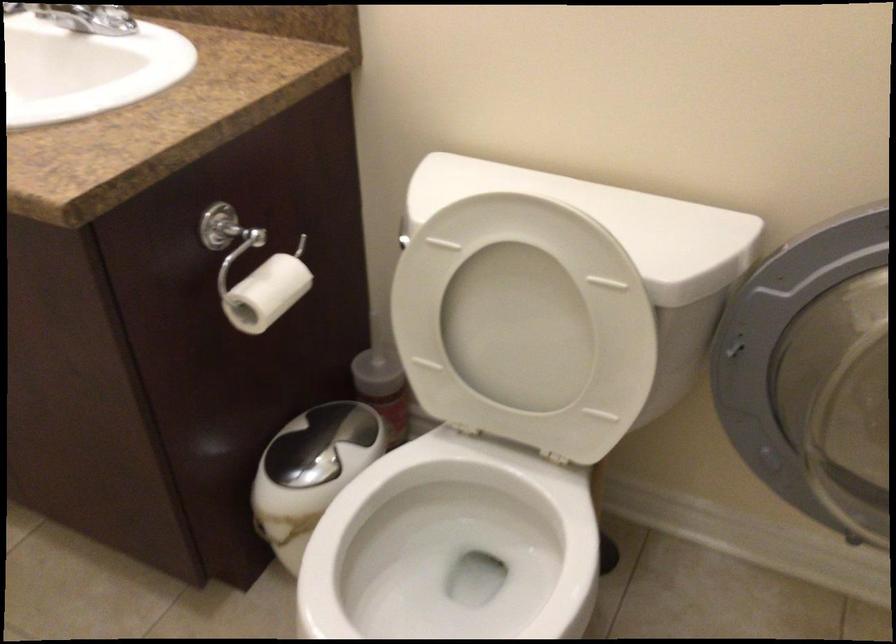
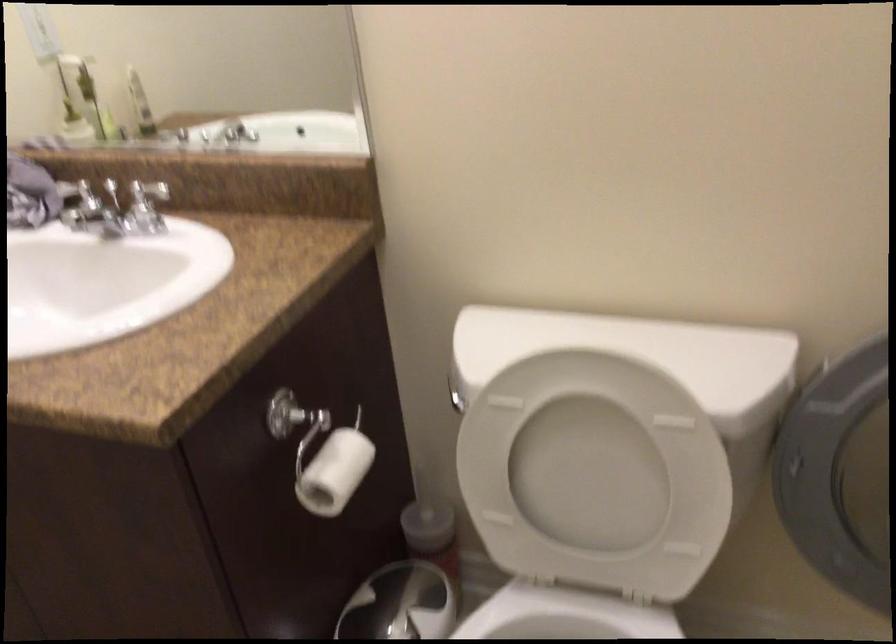
Find the pixel in the second image that matches (527,335) in the first image.

(595, 475)